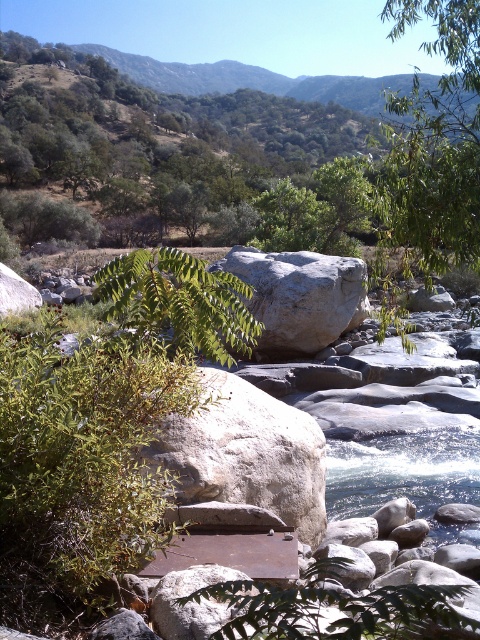
You are standing at the edge of the river and see two points marked in the image. Which point, point (291,432) or point (416,497), is closer to you?

Point (291,432) is closer to the camera than point (416,497), so it is closer to you.

You are a hiker who wants to take a photo of the gray rough boulder at center without the green leafy tree at upper right blocking the view. Which direction should you move to ensure the tree is out of frame?

The green leafy tree at upper right is in front of the gray rough boulder at center, so you should move to the left or right to position yourself where the tree is no longer between you and the boulder.

You are standing on the gray rough rock at center and want to jump to the clear water at river center. Based on their heights, will you land safely in the water?

The gray rough rock at center is taller than clear water at river center, so jumping from the gray rough rock at center to the clear water at river center may result in injury due to the height difference. It is not recommended to jump.